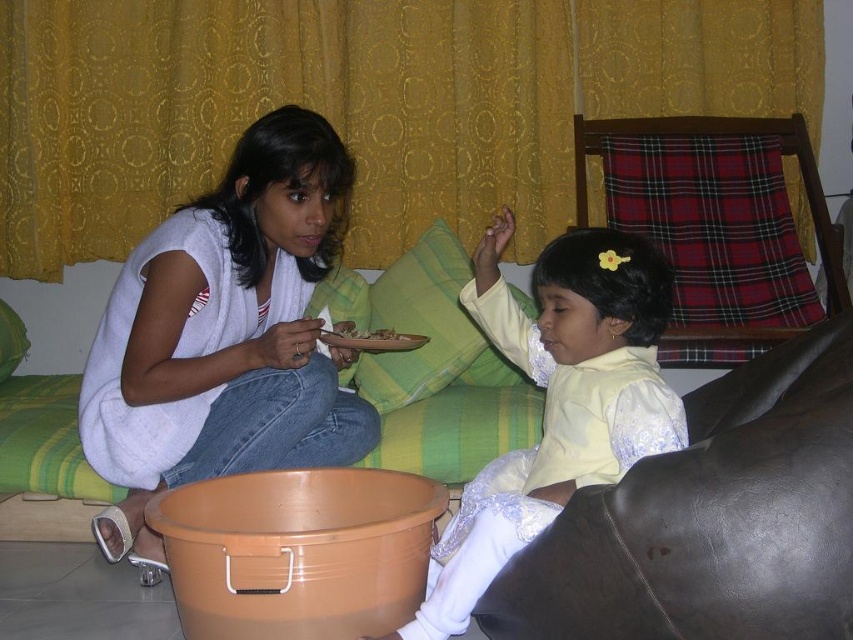
Is silky yellow dress at center smaller than smooth brown plate at center?

No.

Is silky yellow dress at center taller than smooth brown plate at center?

Yes, silky yellow dress at center is taller than smooth brown plate at center.

Who is more distant from viewer, [581,380] or [386,333]?

Positioned behind is point [386,333].

At what (x,y) coordinates should I click in order to perform the action: click on silky yellow dress at center. Please return your answer as a coordinate pair (x, y). Looking at the image, I should click on point(556,401).

In the scene shown: Which is more to the left, matte white sweater at center or silky yellow dress at center?

From the viewer's perspective, matte white sweater at center appears more on the left side.

In the scene shown: Is matte white sweater at center thinner than silky yellow dress at center?

No, matte white sweater at center is not thinner than silky yellow dress at center.

Describe the element at coordinates (225, 333) in the screenshot. This screenshot has width=853, height=640. I see `matte white sweater at center` at that location.

At what (x,y) coordinates should I click in order to perform the action: click on matte white sweater at center. Please return your answer as a coordinate pair (x, y). Image resolution: width=853 pixels, height=640 pixels. Looking at the image, I should click on (225, 333).

Can you confirm if matte yellow dress at center is shorter than silky yellow dress at center?

Yes.

Can you confirm if matte yellow dress at center is positioned below silky yellow dress at center?

Yes.

Between point (599, 588) and point (631, 401), which one is positioned in front?

Point (599, 588) is in front.

You are a GUI agent. You are given a task and a screenshot of the screen. Output one action in this format:
    pyautogui.click(x=<x>, y=<y>)
    Task: Click on the matte yellow dress at center
    
    Given the screenshot: What is the action you would take?
    pyautogui.click(x=711, y=518)